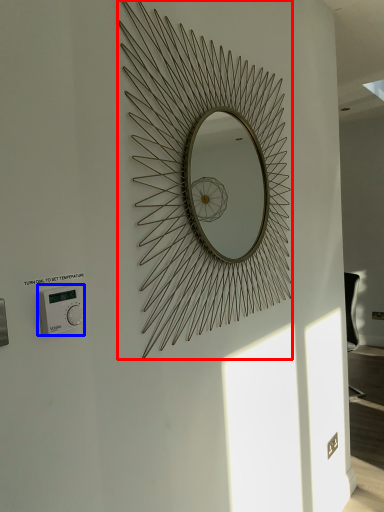
Question: Which of the following is the farthest to the observer, oval (highlighted by a red box) or thermostat (highlighted by a blue box)?

Choices:
 (A) oval
 (B) thermostat

Answer: (A)